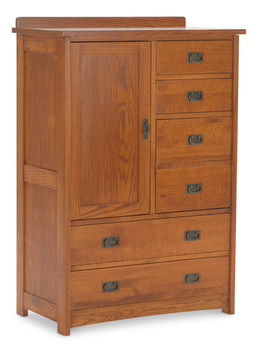
This screenshot has width=258, height=360. Find the location of `drawer compartment`. drawer compartment is located at coordinates (185, 64), (181, 108), (180, 144), (176, 189), (180, 239), (172, 279).